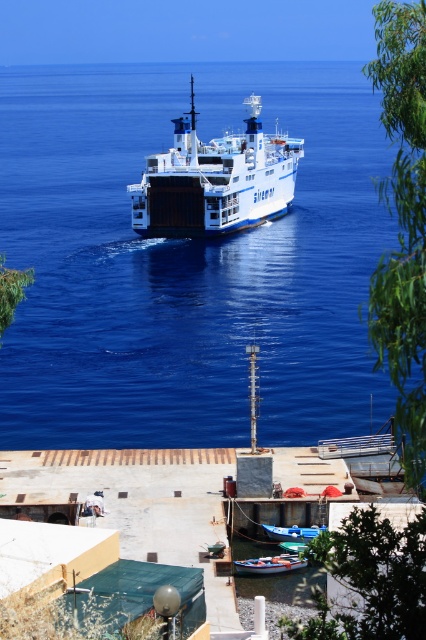
You are a sailor trying to determine which vessel is taller between the white matte ferry at center and the blue matte boat at lower center. Based on the scene, which one is taller?

The white matte ferry at center is taller than the blue matte boat at lower center according to the description.

You are a passenger on the white matte ferry at center and want to disembark to the wooden boat at lower center. Can you walk directly to it from your current position?

The wooden boat at lower center is behind the white matte ferry at center, so you cannot walk directly to it from your current position on the ferry.